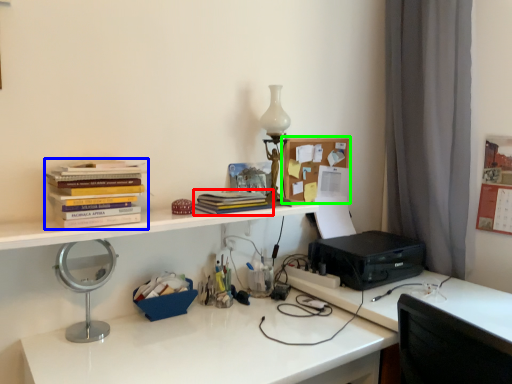
Question: Based on their relative distances, which object is nearer to book (highlighted by a red box)? Choose from book (highlighted by a blue box) and shelf (highlighted by a green box).

Choices:
 (A) book
 (B) shelf

Answer: (B)